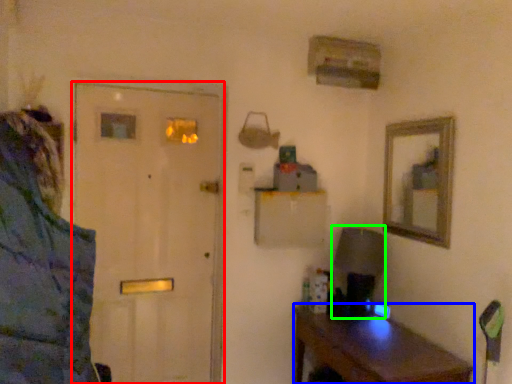
Question: Estimate the real-world distances between objects in this image. Which object is closer to door (highlighted by a red box), desk (highlighted by a blue box) or table lamp (highlighted by a green box)?

Choices:
 (A) desk
 (B) table lamp

Answer: (A)